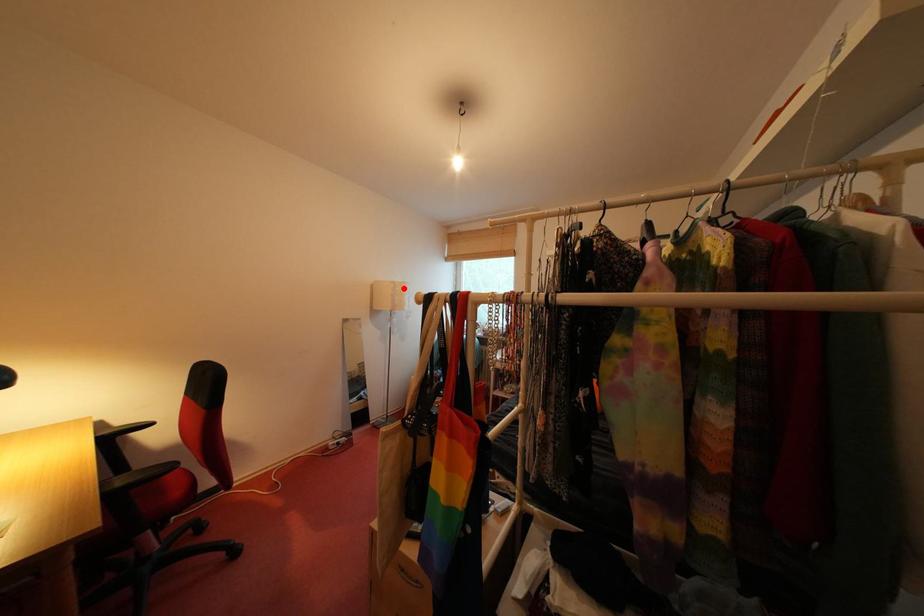
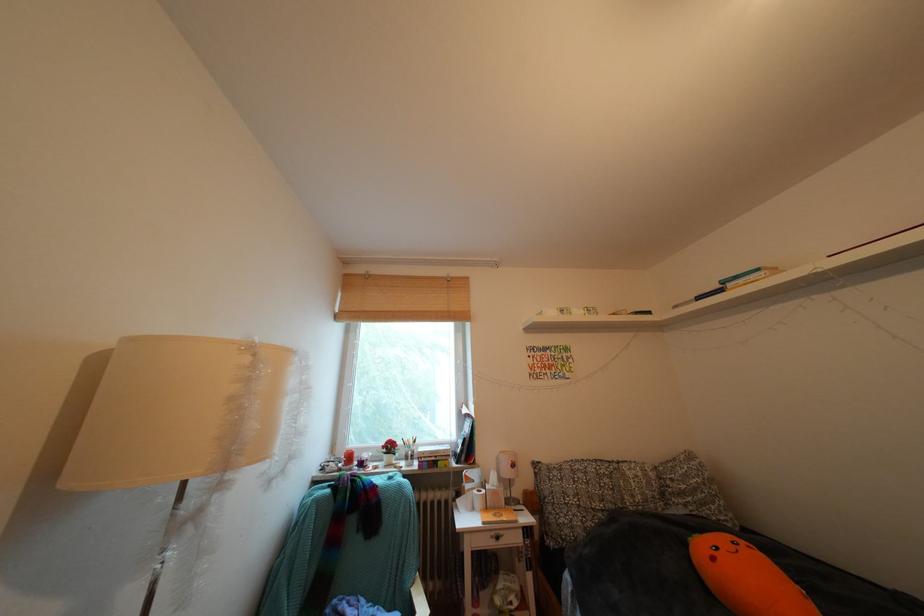
Where in the second image is the point corresponding to the highlighted location from the first image?

(259, 353)